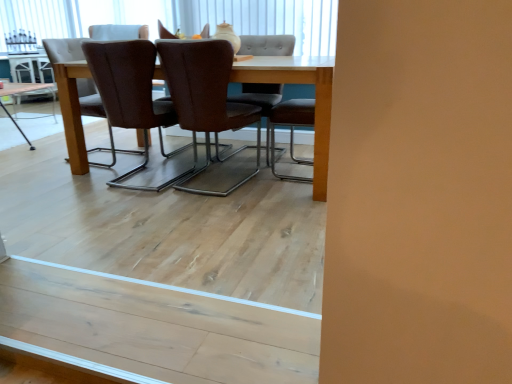
This screenshot has width=512, height=384. Describe the element at coordinates (206, 98) in the screenshot. I see `brown leather chair at center, the fifth chair positioned from the back` at that location.

The width and height of the screenshot is (512, 384). What do you see at coordinates (118, 32) in the screenshot? I see `white leather chair at upper center, the first chair in the back-to-front sequence` at bounding box center [118, 32].

Identify the location of light wood table at center, which is the first table from back to front. This screenshot has width=512, height=384. (31, 76).

This screenshot has height=384, width=512. Describe the element at coordinates (267, 45) in the screenshot. I see `brown leather chair at center, which appears as the 3th chair when viewed from the front` at that location.

How much space does brown leather chair at center, which appears as the 3th chair when viewed from the front, occupy vertically?

The height of brown leather chair at center, which appears as the 3th chair when viewed from the front, is 34.88 inches.

This screenshot has width=512, height=384. What do you see at coordinates (132, 96) in the screenshot?
I see `brown leather chair at center, acting as the 4th chair starting from the back` at bounding box center [132, 96].

Locate an element on the screen. This screenshot has width=512, height=384. brown leather chair at center, the fifth chair positioned from the back is located at coordinates (206, 98).

Considering their positions, is brown leather chair at center, acting as the 1th chair starting from the front, located in front of or behind brown leather chair at center, acting as the 4th chair starting from the back?

brown leather chair at center, acting as the 1th chair starting from the front, is in front of brown leather chair at center, acting as the 4th chair starting from the back.

How different are the orientations of brown leather chair at center, the fifth chair positioned from the back, and brown leather chair at center, acting as the 4th chair starting from the back, in degrees?

brown leather chair at center, the fifth chair positioned from the back, and brown leather chair at center, acting as the 4th chair starting from the back, are facing 0.763 degrees away from each other.

Is point (202, 111) farther from camera compared to point (103, 100)?

No, (202, 111) is closer to viewer.

From the image's perspective, relative to brown leather chair at center, acting as the 2th chair starting from the front, is brown leather chair at center, the fifth chair positioned from the back, above or below?

Clearly, from the image's perspective, brown leather chair at center, the fifth chair positioned from the back, is below brown leather chair at center, acting as the 2th chair starting from the front.

Considering the positions of objects light wood table at center, which appears as the first table when ordered from the bottom, and brown leather chair at center, the 3th chair when ordered from back to front, in the image provided, who is more to the left, light wood table at center, which appears as the first table when ordered from the bottom, or brown leather chair at center, the 3th chair when ordered from back to front,?

light wood table at center, which appears as the first table when ordered from the bottom.

From a real-world perspective, is light wood table at center, which appears as the second table when viewed from the left, above or below brown leather chair at center, which appears as the 3th chair when viewed from the front?

light wood table at center, which appears as the second table when viewed from the left, is below brown leather chair at center, which appears as the 3th chair when viewed from the front.

Considering the sizes of light wood table at center, the 2th table viewed from the back, and brown leather chair at center, which appears as the 3th chair when viewed from the front, in the image, is light wood table at center, the 2th table viewed from the back, wider or thinner than brown leather chair at center, which appears as the 3th chair when viewed from the front,?

Considering their sizes, light wood table at center, the 2th table viewed from the back, looks broader than brown leather chair at center, which appears as the 3th chair when viewed from the front.

Is light wood table at center, marked as the 2th table in a front-to-back arrangement, oriented towards brown leather chair at center, the 3th chair when ordered from back to front?

No, light wood table at center, marked as the 2th table in a front-to-back arrangement, is not aimed at brown leather chair at center, the 3th chair when ordered from back to front.

Which point is more distant from viewer, (16, 83) or (246, 95)?

The point (16, 83) is behind.

Measure the distance between light wood table at center, which is the first table from back to front, and brown leather chair at center, the 3th chair when ordered from back to front.

light wood table at center, which is the first table from back to front, is 2.29 meters from brown leather chair at center, the 3th chair when ordered from back to front.

Is light wood table at center, acting as the second table starting from the right, surrounding brown leather chair at center, which appears as the 3th chair when viewed from the front?

No, brown leather chair at center, which appears as the 3th chair when viewed from the front, is not surrounded by light wood table at center, acting as the second table starting from the right.

Are brown leather chair at center, acting as the 1th chair starting from the front, and light wood table at center, the second table when ordered from bottom to top, far apart?

Yes, brown leather chair at center, acting as the 1th chair starting from the front, and light wood table at center, the second table when ordered from bottom to top, are located far from each other.

How distant is brown leather chair at center, the fifth chair positioned from the back, from light wood table at center, the second table when ordered from bottom to top?

brown leather chair at center, the fifth chair positioned from the back, and light wood table at center, the second table when ordered from bottom to top, are 7.99 feet apart.

From the image's perspective, is brown leather chair at center, acting as the 1th chair starting from the front, located beneath light wood table at center, which is counted as the first table, starting from the top?

Indeed, from the image's perspective, brown leather chair at center, acting as the 1th chair starting from the front, is shown beneath light wood table at center, which is counted as the first table, starting from the top.

Consider the image. From a real-world perspective, relative to light wood table at center, the second table when ordered from bottom to top, is brown leather chair at center, acting as the 1th chair starting from the front, vertically above or below?

From a real-world perspective, brown leather chair at center, acting as the 1th chair starting from the front, is physically above light wood table at center, the second table when ordered from bottom to top.

From a real-world perspective, is light wood table at center, which is the second table from top to bottom, under brown leather chair at center, acting as the 1th chair starting from the front?

Indeed, from a real-world perspective, light wood table at center, which is the second table from top to bottom, is positioned beneath brown leather chair at center, acting as the 1th chair starting from the front.

Which of these two, light wood table at center, the 2th table viewed from the back, or brown leather chair at center, the fifth chair positioned from the back, is bigger?

With larger size is brown leather chair at center, the fifth chair positioned from the back.

Are light wood table at center, which appears as the second table when viewed from the left, and brown leather chair at center, acting as the 1th chair starting from the front, far apart?

light wood table at center, which appears as the second table when viewed from the left, is far away from brown leather chair at center, acting as the 1th chair starting from the front.

Based on the photo, can we say light wood table at center, which is the first table in front-to-back order, lies outside brown leather chair at center, the fifth chair positioned from the back?

Yes, light wood table at center, which is the first table in front-to-back order, is outside of brown leather chair at center, the fifth chair positioned from the back.

How many degrees apart are the facing directions of brown leather chair at center, the fifth chair positioned from the back, and light wood table at center, which is the first table in front-to-back order?

The angular difference between brown leather chair at center, the fifth chair positioned from the back, and light wood table at center, which is the first table in front-to-back order, is 1.13 degrees.

Would you say brown leather chair at center, the fifth chair positioned from the back, contains light wood table at center, which appears as the second table when viewed from the left?

That's incorrect, light wood table at center, which appears as the second table when viewed from the left, is not inside brown leather chair at center, the fifth chair positioned from the back.

Does brown leather chair at center, the fifth chair positioned from the back, have a greater width compared to light wood table at center, which is the 1th table in right-to-left order?

No, brown leather chair at center, the fifth chair positioned from the back, is not wider than light wood table at center, which is the 1th table in right-to-left order.

Is point (187, 56) closer or farther from the camera than point (29, 87)?

Clearly, point (187, 56) is closer to the camera than point (29, 87).

From a real-world perspective, between brown leather chair at center, the second chair when ordered from back to front, and light wood table at center, which is the 1th table in right-to-left order, who is vertically higher?

In real-world perspective, brown leather chair at center, the second chair when ordered from back to front, is above.

Based on the photo, between brown leather chair at center, which is the fourth chair in front-to-back order, and light wood table at center, which appears as the second table when viewed from the left, which one has less height?

Standing shorter between the two is light wood table at center, which appears as the second table when viewed from the left.

Is point (74, 59) closer to camera compared to point (30, 148)?

Yes, point (74, 59) is in front of point (30, 148).

From the image's perspective, which chair is the 2nd one below the light wood table at center, the 2th table viewed from the back? Please provide its 2D coordinates.

[(64, 49)]

Where is `chair that is the 1st one when counting leftward from the brown leather chair at center, acting as the 1th chair starting from the front`? This screenshot has height=384, width=512. chair that is the 1st one when counting leftward from the brown leather chair at center, acting as the 1th chair starting from the front is located at coordinates (132, 96).

Starting from the light wood table at center, which is the 1th table in right-to-left order, which chair is the 5th one to the right? Please provide its 2D coordinates.

[(267, 45)]

Based on their spatial positions, is brown leather chair at center, which is the fourth chair in front-to-back order, or light wood table at center, which is the 1th table in right-to-left order, further from brown leather chair at center, acting as the 1th chair starting from the front?

light wood table at center, which is the 1th table in right-to-left order, lies further to brown leather chair at center, acting as the 1th chair starting from the front, than the other object.

Based on their spatial positions, is white leather chair at upper center, the 5th chair when ordered from front to back, or light wood table at center, which appears as the second table when viewed from the left, further from light wood table at center, acting as the second table starting from the right?

Based on the image, white leather chair at upper center, the 5th chair when ordered from front to back, appears to be further to light wood table at center, acting as the second table starting from the right.

Which object lies nearer to the anchor point brown leather chair at center, the second chair when ordered from back to front, brown leather chair at center, the 3th chair when ordered from back to front, or light wood table at center, which is counted as the first table, starting from the top?

brown leather chair at center, the 3th chair when ordered from back to front, is closer to brown leather chair at center, the second chair when ordered from back to front.

From the image, which object appears to be nearer to brown leather chair at center, acting as the 4th chair starting from the back, brown leather chair at center, the fifth chair positioned from the back, or white leather chair at upper center, the first chair in the back-to-front sequence?

Based on the image, brown leather chair at center, the fifth chair positioned from the back, appears to be nearer to brown leather chair at center, acting as the 4th chair starting from the back.

Looking at the image, which one is located closer to light wood table at center, marked as the 2th table in a front-to-back arrangement, brown leather chair at center, which is the fourth chair in front-to-back order, or brown leather chair at center, acting as the 1th chair starting from the front?

The object closer to light wood table at center, marked as the 2th table in a front-to-back arrangement, is brown leather chair at center, which is the fourth chair in front-to-back order.

Estimate the real-world distances between objects in this image. Which object is closer to brown leather chair at center, the fifth chair positioned from the back, brown leather chair at center, acting as the 4th chair starting from the back, or brown leather chair at center, which is the fourth chair in front-to-back order?

brown leather chair at center, acting as the 4th chair starting from the back.

Based on their spatial positions, is brown leather chair at center, acting as the 1th chair starting from the front, or brown leather chair at center, the 3th chair when ordered from back to front, closer to white leather chair at upper center, the first chair in the back-to-front sequence?

brown leather chair at center, acting as the 1th chair starting from the front, lies closer to white leather chair at upper center, the first chair in the back-to-front sequence, than the other object.

Based on their spatial positions, is brown leather chair at center, which appears as the 3th chair when viewed from the front, or white leather chair at upper center, the first chair in the back-to-front sequence, further from light wood table at center, which is counted as the first table, starting from the top?

brown leather chair at center, which appears as the 3th chair when viewed from the front, is positioned further to the anchor light wood table at center, which is counted as the first table, starting from the top.

Where is `table between light wood table at center, the 1th table viewed from the left, and brown leather chair at center, the 3th chair when ordered from back to front`? The height and width of the screenshot is (384, 512). table between light wood table at center, the 1th table viewed from the left, and brown leather chair at center, the 3th chair when ordered from back to front is located at coordinates (21, 88).

Identify the location of chair between brown leather chair at center, which is the fourth chair in front-to-back order, and brown leather chair at center, acting as the 1th chair starting from the front, in the horizontal direction. Image resolution: width=512 pixels, height=384 pixels. (132, 96).

Find the location of a particular element. The image size is (512, 384). table between brown leather chair at center, the second chair when ordered from back to front, and white leather chair at upper center, the 5th chair when ordered from front to back, in the front-back direction is located at coordinates (21, 88).

At what (x,y) coordinates should I click in order to perform the action: click on table located between brown leather chair at center, acting as the 1th chair starting from the front, and white leather chair at upper center, the first chair in the back-to-front sequence, in the depth direction. Please return your answer as a coordinate pair (x, y). Image resolution: width=512 pixels, height=384 pixels. Looking at the image, I should click on (21, 88).